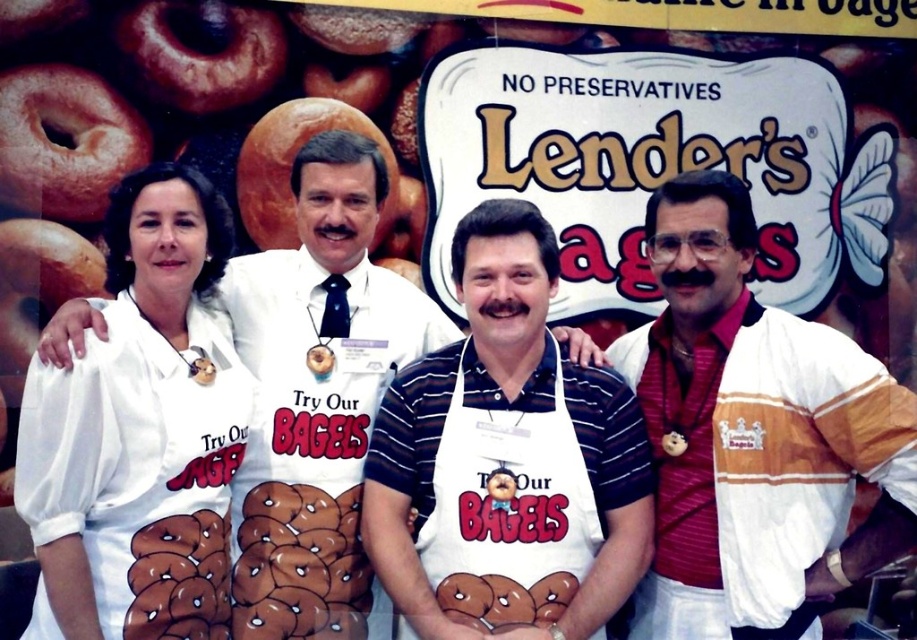
Question: Which object is positioned closest to the white apron with printed design at center?

Choices:
 (A) white striped jacket at right
 (B) white apron with printed bagels at center
 (C) white fabric apron at left

Answer: (A)

Question: Is white fabric apron at left below white apron with printed bagels at center?

Choices:
 (A) yes
 (B) no

Answer: (A)

Question: Is white fabric apron at left closer to the viewer compared to white apron with printed design at center?

Choices:
 (A) no
 (B) yes

Answer: (B)

Question: Among these points, which one is nearest to the camera?

Choices:
 (A) (668, 356)
 (B) (402, 292)

Answer: (A)

Question: Does white apron with printed design at center appear over white apron with printed bagels at center?

Choices:
 (A) yes
 (B) no

Answer: (B)

Question: Which point is closer to the camera?

Choices:
 (A) white apron with printed bagels at center
 (B) white apron with printed design at center
 (C) white striped jacket at right

Answer: (C)